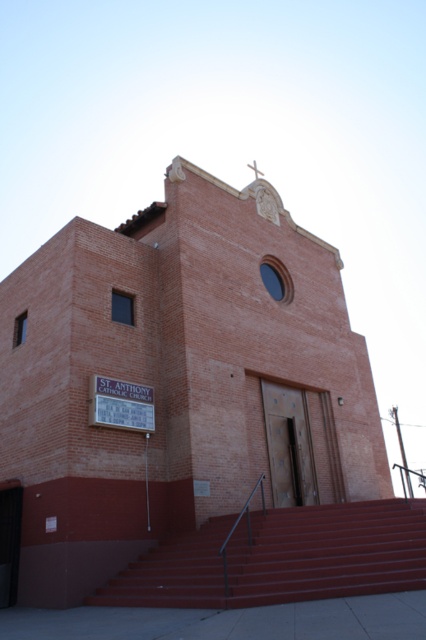
Which is in front, point (209, 273) or point (362, 589)?

Point (362, 589) is more forward.

Does brick church at center have a larger size compared to maroon painted stairs at center?

Yes.

Between point (72, 413) and point (221, 579), which one is positioned in front?

Point (221, 579) is in front.

Identify the location of brick church at center. This screenshot has width=426, height=640. (176, 380).